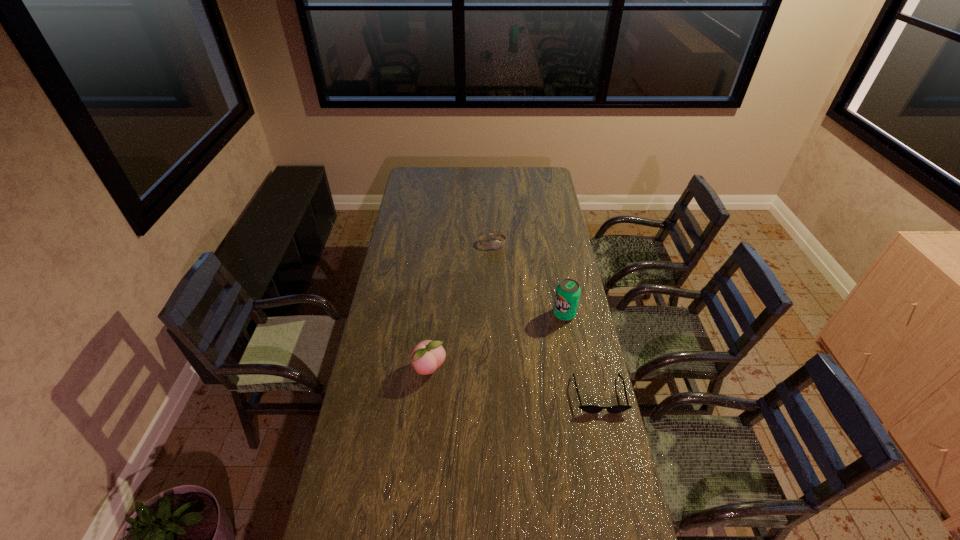
Locate an element on the screen. Image resolution: width=960 pixels, height=540 pixels. free space located on the front-facing side of the third nearest object is located at coordinates (x=544, y=332).

You are a GUI agent. You are given a task and a screenshot of the screen. Output one action in this format:
    pyautogui.click(x=<x>, y=<y>)
    Task: Click on the free space located 0.390m on the front-facing side of the third nearest object
    
    Given the screenshot: What is the action you would take?
    pyautogui.click(x=497, y=377)

Identify the location of vacant area located on the face of the second shortest object. (511, 305).

Where is `vacant region located on the face of the second shortest object`? Image resolution: width=960 pixels, height=540 pixels. vacant region located on the face of the second shortest object is located at coordinates (499, 266).

Locate an element on the screen. The image size is (960, 540). vacant region located 0.290m on the face of the second shortest object is located at coordinates 507,290.

Find the location of a particular element. Image resolution: width=960 pixels, height=540 pixels. sunglasses that is at the right edge is located at coordinates (586, 408).

Where is `pop soda at the right edge`? pop soda at the right edge is located at coordinates (567, 295).

This screenshot has height=540, width=960. In the image, there is a desktop. Find the location of `free region at the far edge`. free region at the far edge is located at coordinates (495, 170).

Image resolution: width=960 pixels, height=540 pixels. What are the coordinates of `free region at the left edge` in the screenshot? It's located at (353, 407).

Identify the location of vacant region at the right edge of the desktop. (592, 354).